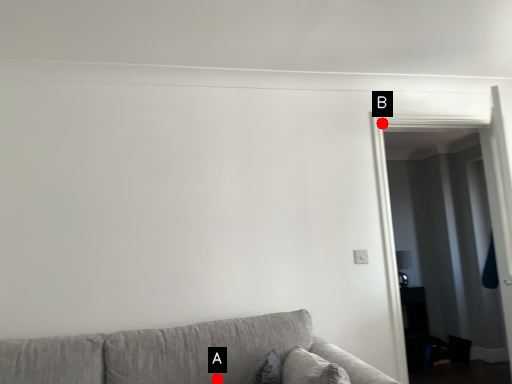
Question: Two points are circled on the image, labeled by A and B beside each circle. Which point is farther to the camera?

Choices:
 (A) A is further
 (B) B is further

Answer: (B)